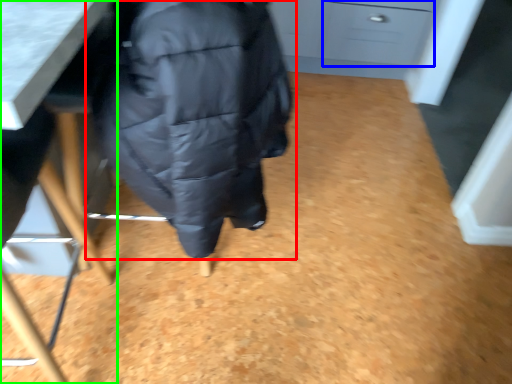
Question: Which is farther away from jacket (highlighted by a red box)? drawer (highlighted by a blue box) or furniture (highlighted by a green box)?

Choices:
 (A) drawer
 (B) furniture

Answer: (A)